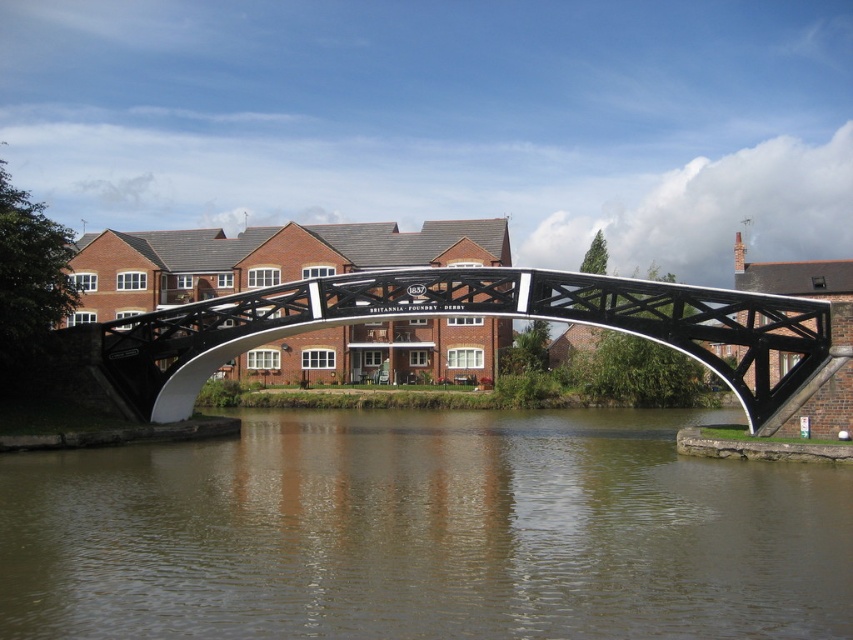
Between point (548, 452) and point (177, 362), which one is positioned in front?

Point (548, 452) is more forward.

Can you confirm if brown murky water at center is positioned above black metal pedestrian bridge at center?

No, brown murky water at center is not above black metal pedestrian bridge at center.

The image size is (853, 640). Find the location of `brown murky water at center`. brown murky water at center is located at coordinates (425, 532).